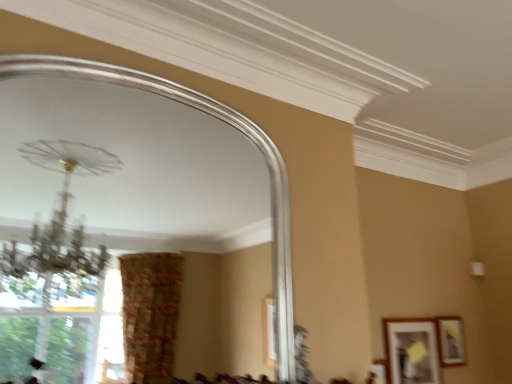
What is the approximate width of matte black picture frame at lower right, which is counted as the second picture frame, starting from the right?

1.25 inches.

The image size is (512, 384). What do you see at coordinates (412, 350) in the screenshot?
I see `matte black picture frame at lower right, which is counted as the second picture frame, starting from the right` at bounding box center [412, 350].

Find the location of a particular element. The image size is (512, 384). silver metallic mirror at upper center is located at coordinates (218, 118).

From the image's perspective, is matte black picture frame at lower right, the 1th picture frame from the left, on silver metallic mirror at upper center?

No, from the image's perspective, matte black picture frame at lower right, the 1th picture frame from the left, is not above silver metallic mirror at upper center.

Considering the positions of point (418, 368) and point (281, 378), is point (418, 368) closer or farther from the camera than point (281, 378)?

Point (418, 368) appears to be farther away from the viewer than point (281, 378).

Is matte black picture frame at lower right, which is counted as the second picture frame, starting from the right, placed right next to silver metallic mirror at upper center?

No, matte black picture frame at lower right, which is counted as the second picture frame, starting from the right, is not making contact with silver metallic mirror at upper center.

Between matte black picture frame at lower right, which is counted as the second picture frame, starting from the right, and silver metallic mirror at upper center, which one has larger width?

silver metallic mirror at upper center is wider.

Does matte black picture frame at lower right, the 1th picture frame from the left, turn towards matte gold picture frame at lower right, the first picture frame from the right?

No.

Can you confirm if matte black picture frame at lower right, the 1th picture frame from the left, is positioned to the right of matte gold picture frame at lower right, placed as the 2th picture frame when sorted from left to right?

No, matte black picture frame at lower right, the 1th picture frame from the left, is not to the right of matte gold picture frame at lower right, placed as the 2th picture frame when sorted from left to right.

Is the position of matte black picture frame at lower right, which is counted as the second picture frame, starting from the right, more distant than that of matte gold picture frame at lower right, placed as the 2th picture frame when sorted from left to right?

No.

Is matte gold picture frame at lower right, placed as the 2th picture frame when sorted from left to right, to the left of matte black picture frame at lower right, which is counted as the second picture frame, starting from the right, from the viewer's perspective?

No, matte gold picture frame at lower right, placed as the 2th picture frame when sorted from left to right, is not to the left of matte black picture frame at lower right, which is counted as the second picture frame, starting from the right.

The width and height of the screenshot is (512, 384). In order to click on picture frame beneath the matte gold picture frame at lower right, the first picture frame from the right (from a real-world perspective) in this screenshot , I will do `click(412, 350)`.

Is matte gold picture frame at lower right, the first picture frame from the right, far from matte black picture frame at lower right, which is counted as the second picture frame, starting from the right?

No, there isn't a large distance between matte gold picture frame at lower right, the first picture frame from the right, and matte black picture frame at lower right, which is counted as the second picture frame, starting from the right.

Can you confirm if matte gold picture frame at lower right, the first picture frame from the right, is wider than matte black picture frame at lower right, which is counted as the second picture frame, starting from the right?

Indeed, matte gold picture frame at lower right, the first picture frame from the right, has a greater width compared to matte black picture frame at lower right, which is counted as the second picture frame, starting from the right.

Is matte gold picture frame at lower right, placed as the 2th picture frame when sorted from left to right, positioned with its back to silver metallic mirror at upper center?

That's not correct — matte gold picture frame at lower right, placed as the 2th picture frame when sorted from left to right, is not looking away from silver metallic mirror at upper center.

Consider the image. Is matte gold picture frame at lower right, placed as the 2th picture frame when sorted from left to right, at the right side of silver metallic mirror at upper center?

Yes, matte gold picture frame at lower right, placed as the 2th picture frame when sorted from left to right, is to the right of silver metallic mirror at upper center.

From the image's perspective, is matte gold picture frame at lower right, placed as the 2th picture frame when sorted from left to right, above or below silver metallic mirror at upper center?

matte gold picture frame at lower right, placed as the 2th picture frame when sorted from left to right, is below silver metallic mirror at upper center.

From the image's perspective, which one is positioned lower, silver metallic mirror at upper center or matte gold picture frame at lower right, placed as the 2th picture frame when sorted from left to right?

matte gold picture frame at lower right, placed as the 2th picture frame when sorted from left to right, from the image's perspective.

Is silver metallic mirror at upper center facing away from matte gold picture frame at lower right, the first picture frame from the right?

silver metallic mirror at upper center is not turned away from matte gold picture frame at lower right, the first picture frame from the right.

Considering the positions of objects silver metallic mirror at upper center and matte gold picture frame at lower right, the first picture frame from the right, in the image provided, who is more to the right, silver metallic mirror at upper center or matte gold picture frame at lower right, the first picture frame from the right,?

From the viewer's perspective, matte gold picture frame at lower right, the first picture frame from the right, appears more on the right side.

Looking at this image, between silver metallic mirror at upper center and matte black picture frame at lower right, which is counted as the second picture frame, starting from the right, which one has less height?

matte black picture frame at lower right, which is counted as the second picture frame, starting from the right.

Considering the relative positions of silver metallic mirror at upper center and matte black picture frame at lower right, which is counted as the second picture frame, starting from the right, in the image provided, is silver metallic mirror at upper center in front of matte black picture frame at lower right, which is counted as the second picture frame, starting from the right,?

Yes, it is.

Considering the points (42, 56) and (407, 382), which point is behind, point (42, 56) or point (407, 382)?

The point (407, 382) is behind.

Locate an element on the screen. The image size is (512, 384). mirror that is on the left side of matte black picture frame at lower right, the 1th picture frame from the left is located at coordinates (218, 118).

From the silver metallic mirror at upper center, count 1st picture frames backward and point to it. Please provide its 2D coordinates.

[(412, 350)]

This screenshot has width=512, height=384. Identify the location of picture frame located above the matte black picture frame at lower right, which is counted as the second picture frame, starting from the right (from the image's perspective). [x=450, y=341].

Which object lies further to the anchor point matte gold picture frame at lower right, the first picture frame from the right, matte black picture frame at lower right, which is counted as the second picture frame, starting from the right, or silver metallic mirror at upper center?

silver metallic mirror at upper center lies further to matte gold picture frame at lower right, the first picture frame from the right, than the other object.

Looking at the image, which one is located closer to matte black picture frame at lower right, which is counted as the second picture frame, starting from the right, silver metallic mirror at upper center or matte gold picture frame at lower right, placed as the 2th picture frame when sorted from left to right?

The object closer to matte black picture frame at lower right, which is counted as the second picture frame, starting from the right, is matte gold picture frame at lower right, placed as the 2th picture frame when sorted from left to right.

From the image, which object appears to be farther from silver metallic mirror at upper center, matte black picture frame at lower right, the 1th picture frame from the left, or matte gold picture frame at lower right, the first picture frame from the right?

Among the two, matte gold picture frame at lower right, the first picture frame from the right, is located further to silver metallic mirror at upper center.

Considering their positions, is silver metallic mirror at upper center positioned further to matte gold picture frame at lower right, the first picture frame from the right, than matte black picture frame at lower right, which is counted as the second picture frame, starting from the right?

Among the two, silver metallic mirror at upper center is located further to matte gold picture frame at lower right, the first picture frame from the right.

Considering their positions, is matte gold picture frame at lower right, placed as the 2th picture frame when sorted from left to right, positioned closer to matte black picture frame at lower right, which is counted as the second picture frame, starting from the right, than silver metallic mirror at upper center?

matte gold picture frame at lower right, placed as the 2th picture frame when sorted from left to right.

In the scene shown: Estimate the real-world distances between objects in this image. Which object is closer to silver metallic mirror at upper center, matte gold picture frame at lower right, the first picture frame from the right, or matte black picture frame at lower right, which is counted as the second picture frame, starting from the right?

matte black picture frame at lower right, which is counted as the second picture frame, starting from the right, is positioned closer to the anchor silver metallic mirror at upper center.

Find the location of a particular element. picture frame between silver metallic mirror at upper center and matte gold picture frame at lower right, placed as the 2th picture frame when sorted from left to right, along the z-axis is located at coordinates (412, 350).